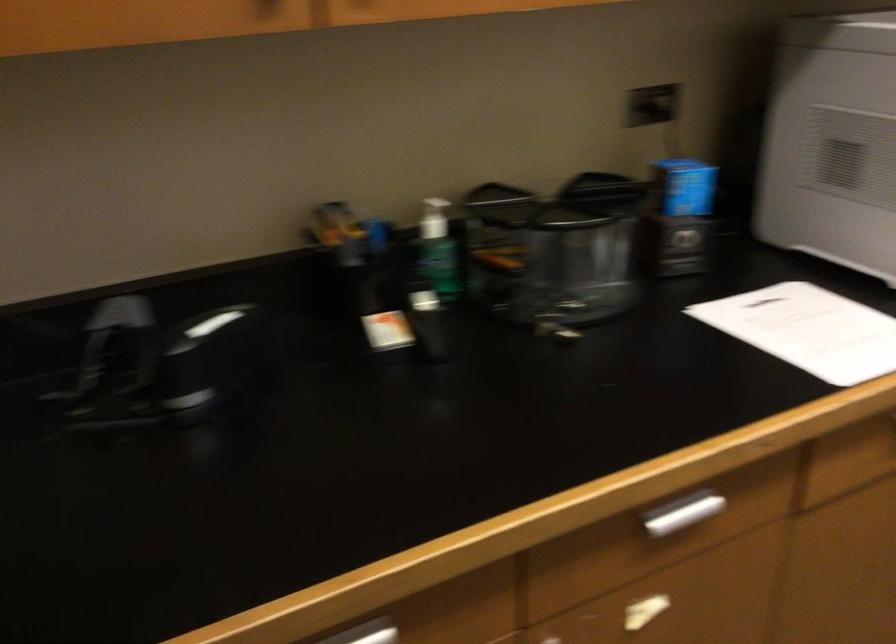
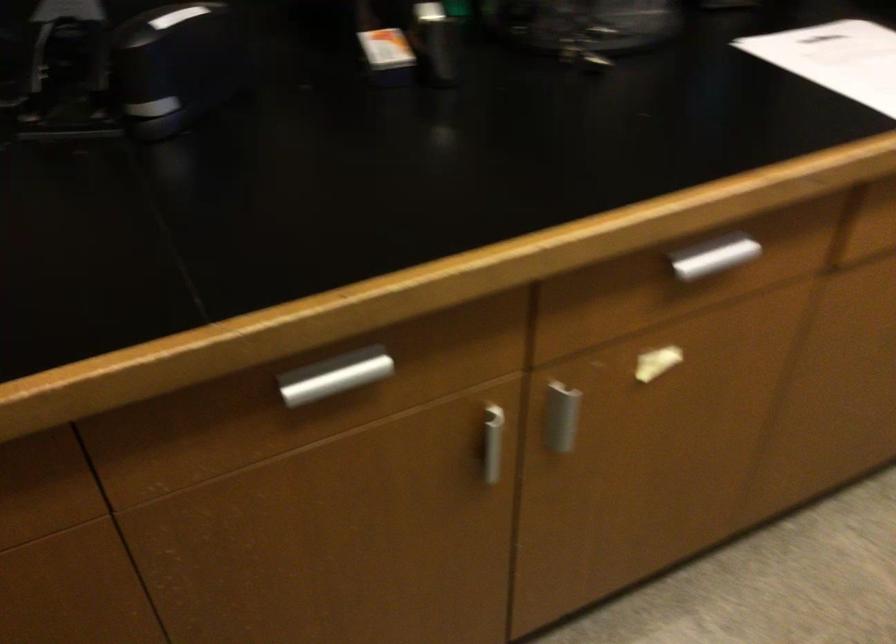
Question: The images are taken continuously from a first-person perspective. In which direction are you moving?

Choices:
 (A) Left
 (B) Right
 (C) Forward
 (D) Backward

Answer: (C)